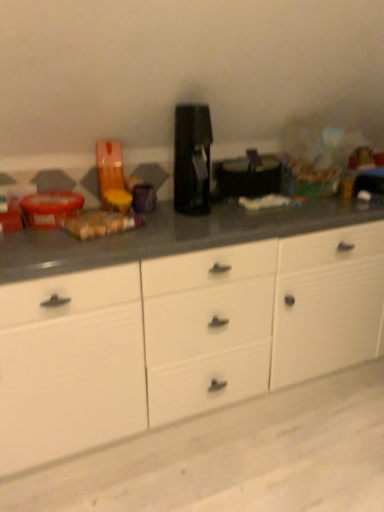
Locate an element on the screen. Image resolution: width=384 pixels, height=512 pixels. vacant area that is in front of black plastic coffee machine at center is located at coordinates (202, 222).